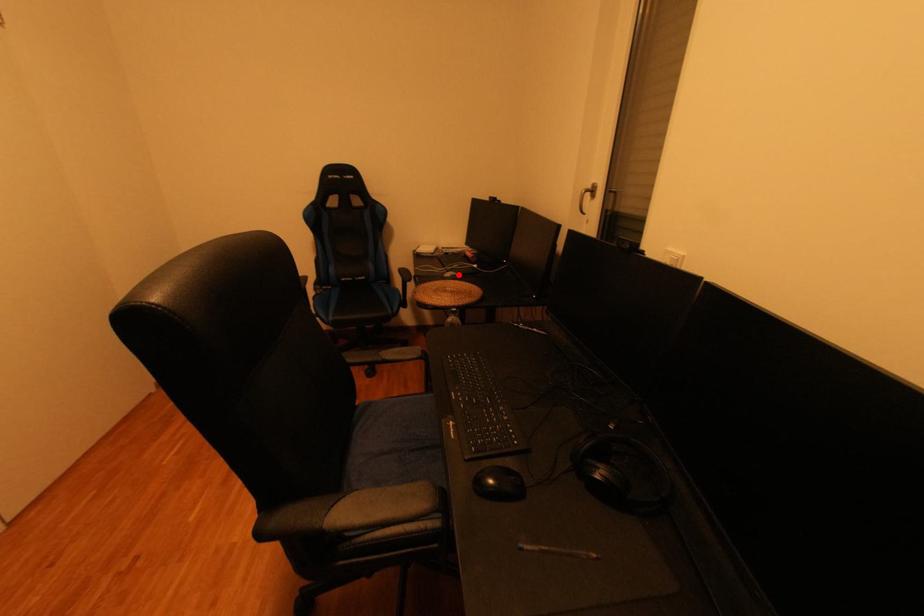
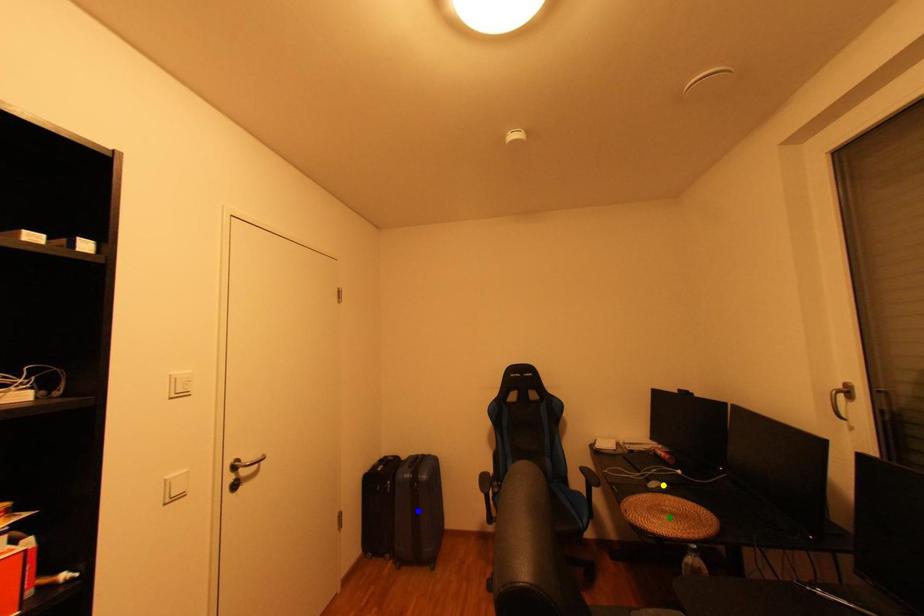
Question: I am providing you with two images of the same scene from different viewpoints. A red point is marked on the first image. You are given multiple points on the second image. Which point in image 2 is actually the same real-world point as the red point in image 1?

Choices:
 (A) green point
 (B) yellow point
 (C) blue point

Answer: (B)